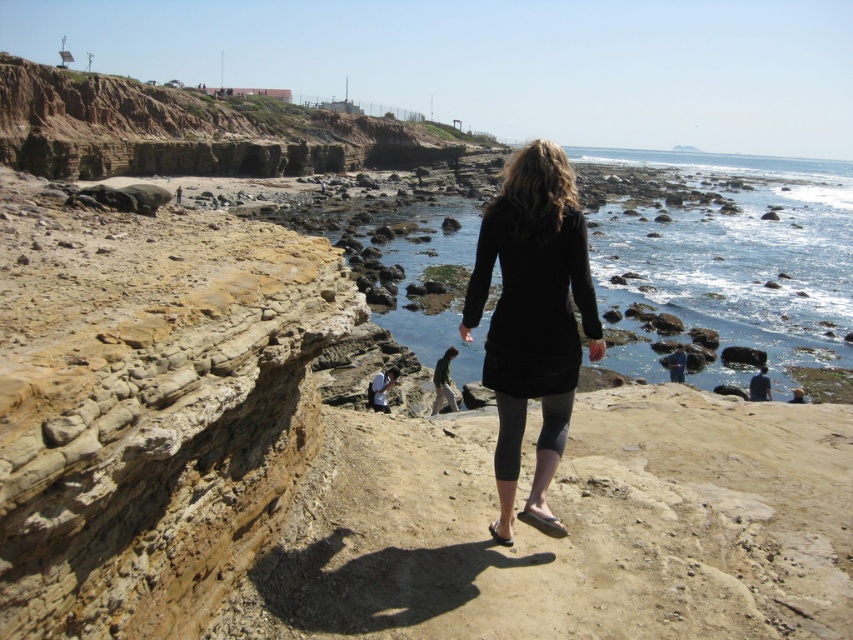
Consider the image. Is black matte dress at center bigger than dark green sweater at center?

Correct, black matte dress at center is larger in size than dark green sweater at center.

Measure the distance from black matte dress at center to dark green sweater at center.

black matte dress at center and dark green sweater at center are 11.60 meters apart.

The image size is (853, 640). Describe the element at coordinates (532, 320) in the screenshot. I see `black matte dress at center` at that location.

Where is `black matte dress at center`? The image size is (853, 640). black matte dress at center is located at coordinates (532, 320).

Based on the photo, who is more distant from viewer, (448, 387) or (805, 397)?

Point (805, 397)

This screenshot has height=640, width=853. I want to click on dark green sweater at center, so click(x=444, y=381).

The width and height of the screenshot is (853, 640). I want to click on dark green sweater at center, so click(444, 381).

Between rusty rock cliff at upper left and dark blue fabric at lower right, which one has less height?

dark blue fabric at lower right

Is rusty rock cliff at upper left further to the viewer compared to dark blue fabric at lower right?

Yes.

Which is behind, point (68, 152) or point (759, 397)?

Point (68, 152)

The image size is (853, 640). In order to click on rusty rock cliff at upper left in this screenshot , I will do `click(193, 131)`.